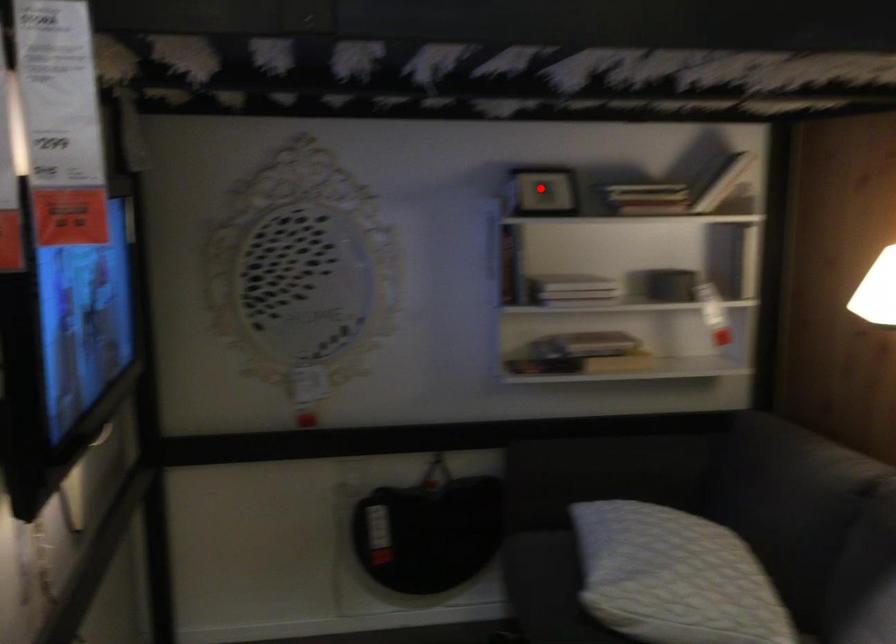
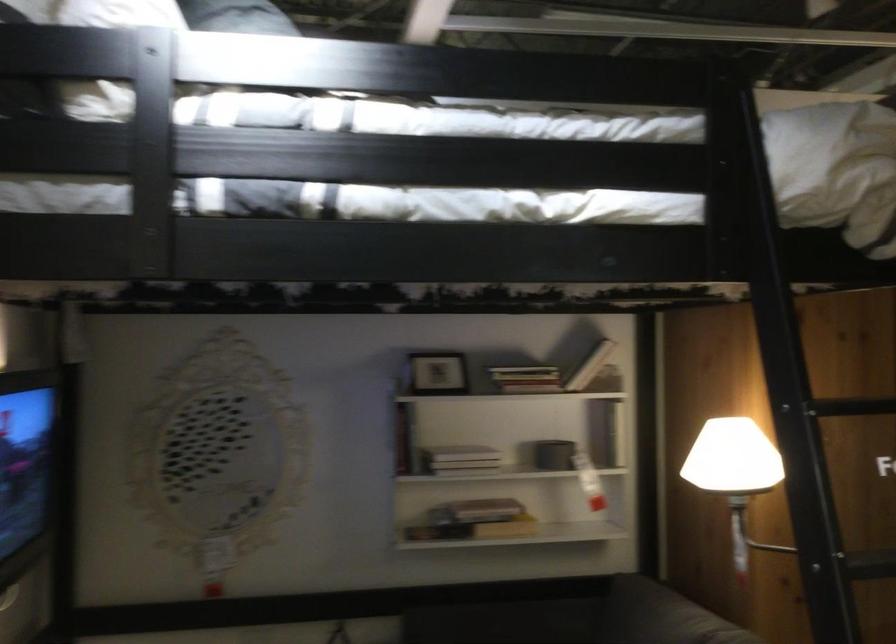
Question: A red point is marked in image1. In image2, is the corresponding 3D point closer to the camera or farther? Reply with the corresponding letter.

Choices:
 (A) The corresponding 3D point is closer.
 (B) The corresponding 3D point is farther.

Answer: (B)